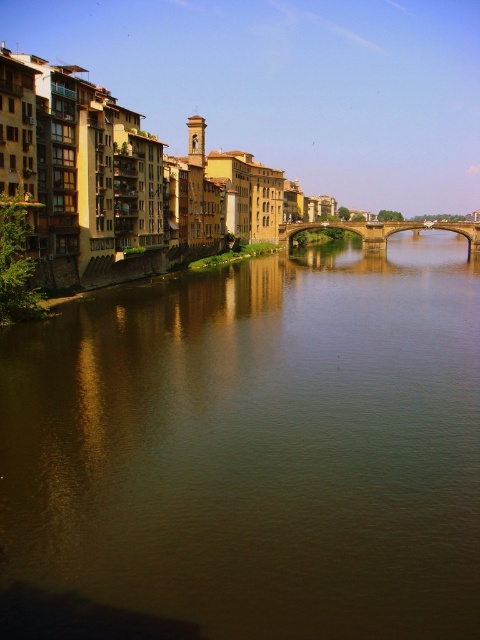
Question: Does brown reflective water at center have a larger size compared to stone arch bridge at center?

Choices:
 (A) no
 (B) yes

Answer: (B)

Question: Is brown reflective water at center positioned at the back of stone arch bridge at center?

Choices:
 (A) no
 (B) yes

Answer: (A)

Question: Does brown reflective water at center have a lesser width compared to stone arch bridge at center?

Choices:
 (A) no
 (B) yes

Answer: (A)

Question: Which point is closer to the camera?

Choices:
 (A) stone arch bridge at center
 (B) brown reflective water at center

Answer: (B)